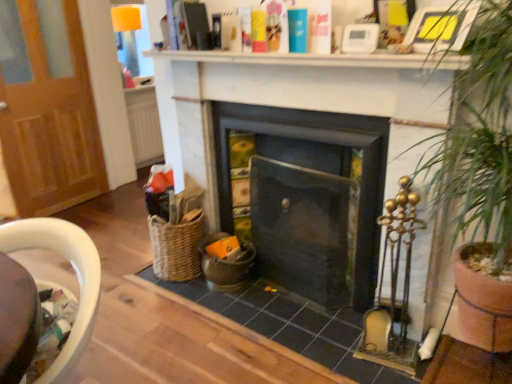
Locate an element on the screen. Image resolution: width=512 pixels, height=384 pixels. wooden door at left is located at coordinates (50, 120).

The height and width of the screenshot is (384, 512). Describe the element at coordinates (50, 120) in the screenshot. I see `wooden door at left` at that location.

The image size is (512, 384). Describe the element at coordinates (76, 274) in the screenshot. I see `woven wicker chair at lower left` at that location.

Describe the element at coordinates (297, 101) in the screenshot. The image size is (512, 384). I see `matte black fireplace at center, acting as the 2th fireplace starting from the right` at that location.

Image resolution: width=512 pixels, height=384 pixels. What are the coordinates of `white matte shelf at upper center` in the screenshot? It's located at (317, 59).

Locate an element on the screen. The image size is (512, 384). wooden door at left is located at coordinates (50, 120).

From a real-world perspective, is woven wicker chair at lower left physically above matte black fireplace at center, acting as the 2th fireplace starting from the right?

Yes, from a real-world perspective, woven wicker chair at lower left is above matte black fireplace at center, acting as the 2th fireplace starting from the right.

Is woven wicker chair at lower left facing away from matte black fireplace at center, arranged as the first fireplace when viewed from the left?

Yes.

Considering the sizes of objects woven wicker chair at lower left and matte black fireplace at center, acting as the 2th fireplace starting from the right, in the image provided, who is shorter, woven wicker chair at lower left or matte black fireplace at center, acting as the 2th fireplace starting from the right,?

Standing shorter between the two is woven wicker chair at lower left.

From the image's perspective, which object appears higher, woven wicker chair at lower left or matte black fireplace at center, arranged as the first fireplace when viewed from the left?

matte black fireplace at center, arranged as the first fireplace when viewed from the left, from the image's perspective.

Considering the sizes of objects green leafy plant at right and matte black fireplace at center, acting as the 2th fireplace starting from the right, in the image provided, who is bigger, green leafy plant at right or matte black fireplace at center, acting as the 2th fireplace starting from the right,?

Bigger between the two is green leafy plant at right.

Does green leafy plant at right have a lesser width compared to matte black fireplace at center, arranged as the first fireplace when viewed from the left?

No, green leafy plant at right is not thinner than matte black fireplace at center, arranged as the first fireplace when viewed from the left.

From the image's perspective, which object appears higher, green leafy plant at right or matte black fireplace at center, arranged as the first fireplace when viewed from the left?

matte black fireplace at center, arranged as the first fireplace when viewed from the left, appears higher in the image.

From a real-world perspective, which is physically above, wooden door at left or woven brown basket at lower left?

wooden door at left.

What are the coordinates of `basket to the right of wooden door at left` in the screenshot? It's located at (176, 248).

Which object is further away from the camera, wooden door at left or woven brown basket at lower left?

wooden door at left is behind.

Considering the relative positions of dark gray stone fireplace at center, the second fireplace when ordered from left to right, and yellow paper picture frame at upper right in the image provided, is dark gray stone fireplace at center, the second fireplace when ordered from left to right, behind yellow paper picture frame at upper right?

Yes.

Which is more to the right, dark gray stone fireplace at center, the 1th fireplace in the right-to-left sequence, or yellow paper picture frame at upper right?

Positioned to the right is yellow paper picture frame at upper right.

From the image's perspective, is dark gray stone fireplace at center, the second fireplace when ordered from left to right, above or below yellow paper picture frame at upper right?

dark gray stone fireplace at center, the second fireplace when ordered from left to right, is below yellow paper picture frame at upper right.

Is dark gray stone fireplace at center, the second fireplace when ordered from left to right, positioned beyond the bounds of yellow paper picture frame at upper right?

Yes.

Is white matte shelf at upper center completely or partially inside matte black fireplace at center, arranged as the first fireplace when viewed from the left?

That's incorrect, white matte shelf at upper center is not inside matte black fireplace at center, arranged as the first fireplace when viewed from the left.

Which object is positioned more to the left, matte black fireplace at center, arranged as the first fireplace when viewed from the left, or white matte shelf at upper center?

white matte shelf at upper center is more to the left.

Are matte black fireplace at center, arranged as the first fireplace when viewed from the left, and white matte shelf at upper center far apart?

matte black fireplace at center, arranged as the first fireplace when viewed from the left, is near white matte shelf at upper center, not far away.

Considering the relative sizes of matte black fireplace at center, acting as the 2th fireplace starting from the right, and white matte shelf at upper center in the image provided, is matte black fireplace at center, acting as the 2th fireplace starting from the right, thinner than white matte shelf at upper center?

Yes.

Is dark gray stone fireplace at center, the 1th fireplace in the right-to-left sequence, positioned beyond the bounds of matte black fireplace at center, acting as the 2th fireplace starting from the right?

No, dark gray stone fireplace at center, the 1th fireplace in the right-to-left sequence, is not outside of matte black fireplace at center, acting as the 2th fireplace starting from the right.

Which object is wider, dark gray stone fireplace at center, the 1th fireplace in the right-to-left sequence, or matte black fireplace at center, acting as the 2th fireplace starting from the right?

With larger width is dark gray stone fireplace at center, the 1th fireplace in the right-to-left sequence.

Is dark gray stone fireplace at center, the 1th fireplace in the right-to-left sequence, smaller than matte black fireplace at center, arranged as the first fireplace when viewed from the left?

Indeed, dark gray stone fireplace at center, the 1th fireplace in the right-to-left sequence, has a smaller size compared to matte black fireplace at center, arranged as the first fireplace when viewed from the left.

Considering the sizes of objects wooden door at left and white matte shelf at upper center in the image provided, who is bigger, wooden door at left or white matte shelf at upper center?

wooden door at left.

From the picture: From the image's perspective, is wooden door at left above or below white matte shelf at upper center?

Clearly, from the image's perspective, wooden door at left is below white matte shelf at upper center.

Who is shorter, wooden door at left or white matte shelf at upper center?

Standing shorter between the two is white matte shelf at upper center.

From a real-world perspective, is wooden door at left on white matte shelf at upper center?

Actually, wooden door at left is physically below white matte shelf at upper center in the real world.

You are a GUI agent. You are given a task and a screenshot of the screen. Output one action in this format:
    pyautogui.click(x=<x>, y=<y>)
    Task: Click on the fireplace that is the 1st one when counting backward from the woven wicker chair at lower left
    The height and width of the screenshot is (384, 512).
    Given the screenshot: What is the action you would take?
    pyautogui.click(x=297, y=101)

Where is `plant that is above the matte black fireplace at center, acting as the 2th fireplace starting from the right (from a real-world perspective)`? plant that is above the matte black fireplace at center, acting as the 2th fireplace starting from the right (from a real-world perspective) is located at coordinates (480, 139).

Estimate the real-world distances between objects in this image. Which object is further from matte black fireplace at center, acting as the 2th fireplace starting from the right, woven wicker chair at lower left or yellow paper picture frame at upper right?

woven wicker chair at lower left is further to matte black fireplace at center, acting as the 2th fireplace starting from the right.

When comparing their distances from wooden door at left, does green leafy plant at right or yellow paper picture frame at upper right seem further?

Based on the image, green leafy plant at right appears to be further to wooden door at left.

When comparing their distances from dark gray stone fireplace at center, the 1th fireplace in the right-to-left sequence, does woven brown basket at lower left or matte black fireplace at center, arranged as the first fireplace when viewed from the left, seem closer?

matte black fireplace at center, arranged as the first fireplace when viewed from the left, is closer to dark gray stone fireplace at center, the 1th fireplace in the right-to-left sequence.

From the image, which object appears to be farther from dark gray stone fireplace at center, the second fireplace when ordered from left to right, woven wicker chair at lower left or yellow paper picture frame at upper right?

woven wicker chair at lower left is further to dark gray stone fireplace at center, the second fireplace when ordered from left to right.

Based on their spatial positions, is green leafy plant at right or matte black fireplace at center, arranged as the first fireplace when viewed from the left, closer to woven brown basket at lower left?

matte black fireplace at center, arranged as the first fireplace when viewed from the left, is closer to woven brown basket at lower left.

Estimate the real-world distances between objects in this image. Which object is closer to yellow paper picture frame at upper right, wooden door at left or green leafy plant at right?

Based on the image, green leafy plant at right appears to be nearer to yellow paper picture frame at upper right.

Based on their spatial positions, is yellow paper picture frame at upper right or woven wicker chair at lower left closer to dark gray stone fireplace at center, the second fireplace when ordered from left to right?

yellow paper picture frame at upper right is closer to dark gray stone fireplace at center, the second fireplace when ordered from left to right.

Considering their positions, is white matte shelf at upper center positioned further to green leafy plant at right than woven wicker chair at lower left?

woven wicker chair at lower left lies further to green leafy plant at right than the other object.

The image size is (512, 384). What are the coordinates of `fireplace situated between wooden door at left and dark gray stone fireplace at center, the second fireplace when ordered from left to right, from left to right` in the screenshot? It's located at (297, 101).

I want to click on fireplace between yellow paper picture frame at upper right and dark gray stone fireplace at center, the second fireplace when ordered from left to right, from top to bottom, so click(297, 101).

I want to click on fireplace between green leafy plant at right and dark gray stone fireplace at center, the second fireplace when ordered from left to right, in the front-back direction, so click(297, 101).

The width and height of the screenshot is (512, 384). I want to click on chair between wooden door at left and green leafy plant at right from left to right, so click(76, 274).